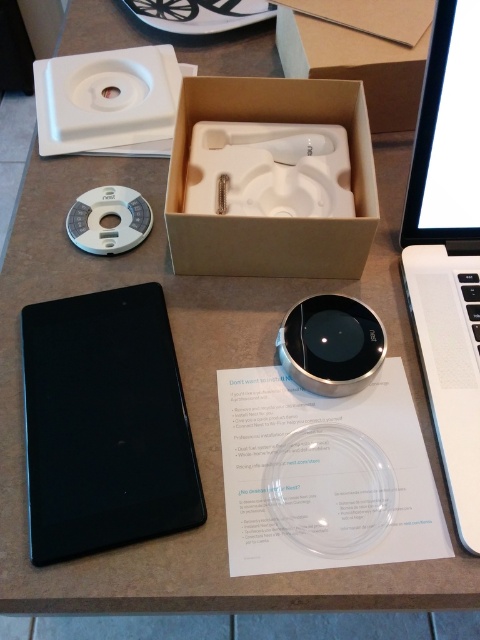
From the picture: Can you confirm if black matte tablet at lower left is positioned to the right of white matte laptop at right?

No, black matte tablet at lower left is not to the right of white matte laptop at right.

Measure the distance between black matte tablet at lower left and camera.

They are 19.60 inches apart.

Image resolution: width=480 pixels, height=640 pixels. Describe the element at coordinates (105, 424) in the screenshot. I see `black matte tablet at lower left` at that location.

Where is `black matte tablet at lower left`? The width and height of the screenshot is (480, 640). black matte tablet at lower left is located at coordinates (105, 424).

Is black matte tablet at lower left shorter than brown cardboard box at center?

No.

Which is in front, point (158, 314) or point (342, 176)?

Point (158, 314) is more forward.

This screenshot has height=640, width=480. In order to click on black matte tablet at lower left in this screenshot , I will do `click(105, 424)`.

How distant is brown cardboard box at center from white plastic cd at upper left?

A: They are 6.59 inches apart.

Between brown cardboard box at center and white plastic cd at upper left, which one has more height?

brown cardboard box at center is taller.

Locate an element on the screen. brown cardboard box at center is located at coordinates (272, 179).

Identify the location of brown cardboard box at center. This screenshot has height=640, width=480. (272, 179).